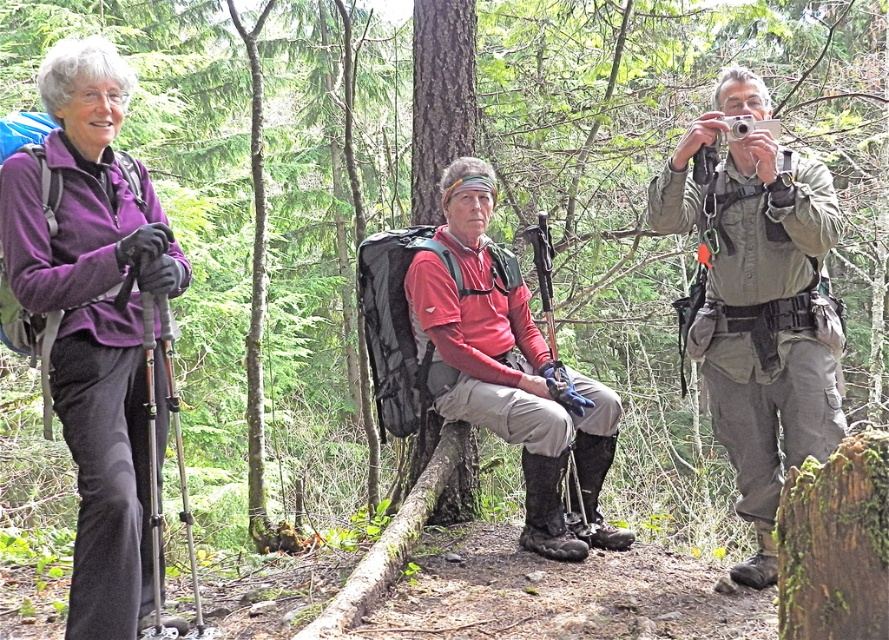
Question: Is purple fleece jacket at left above green camouflage pants at right?

Choices:
 (A) yes
 (B) no

Answer: (B)

Question: Which object appears closest to the camera in this image?

Choices:
 (A) green camouflage pants at right
 (B) matte red shirt at center

Answer: (B)

Question: Which object appears farthest from the camera in this image?

Choices:
 (A) green camouflage pants at right
 (B) purple fleece jacket at left
 (C) reddish-pink fabric shirt at center

Answer: (C)

Question: Is green camouflage pants at right above reddish-pink fabric shirt at center?

Choices:
 (A) no
 (B) yes

Answer: (B)

Question: Does purple fleece jacket at left appear on the right side of reddish-pink fabric shirt at center?

Choices:
 (A) yes
 (B) no

Answer: (B)

Question: Which point is closer to the camera?

Choices:
 (A) purple fleece jacket at left
 (B) matte red shirt at center

Answer: (A)